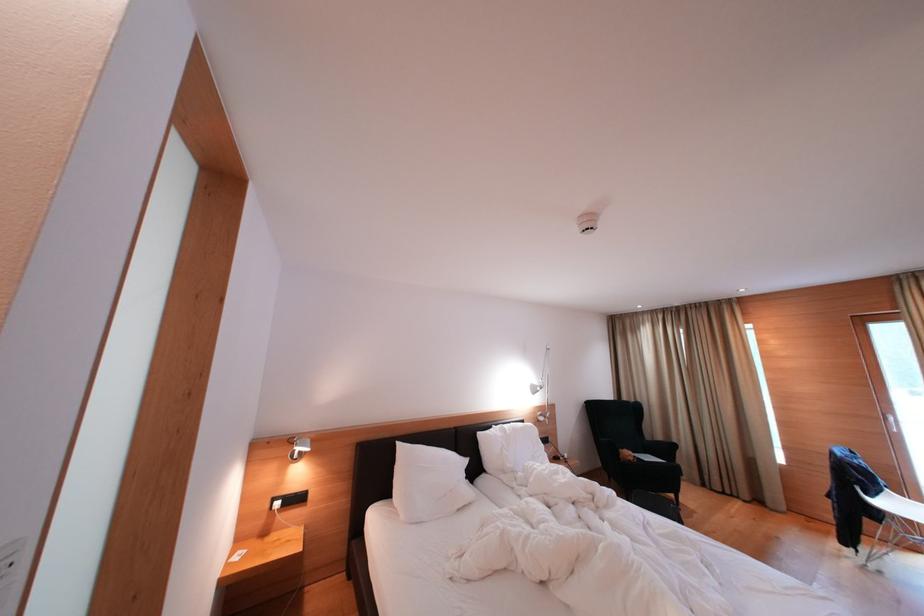
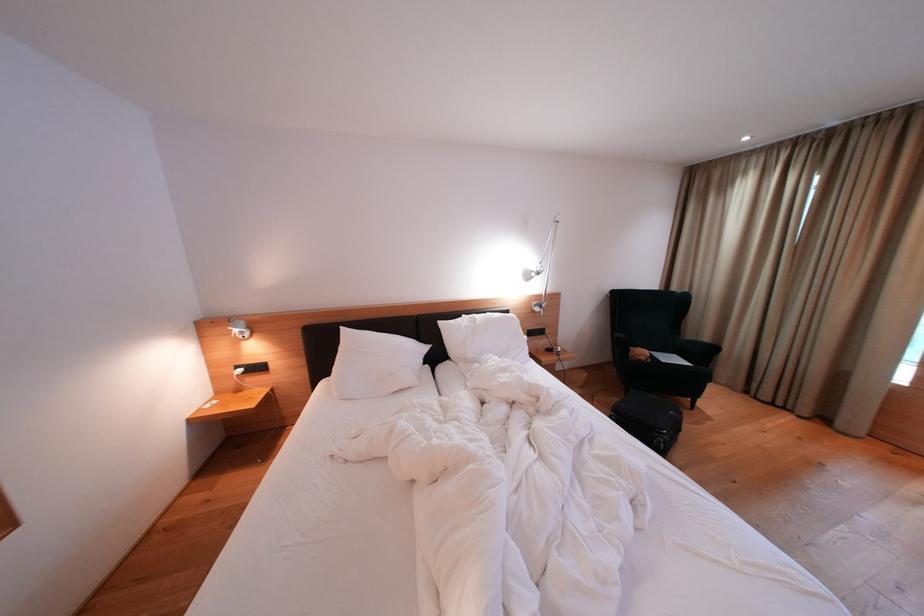
Where in the second image is the point corresponding to pixel 307 456 from the first image?

(249, 336)